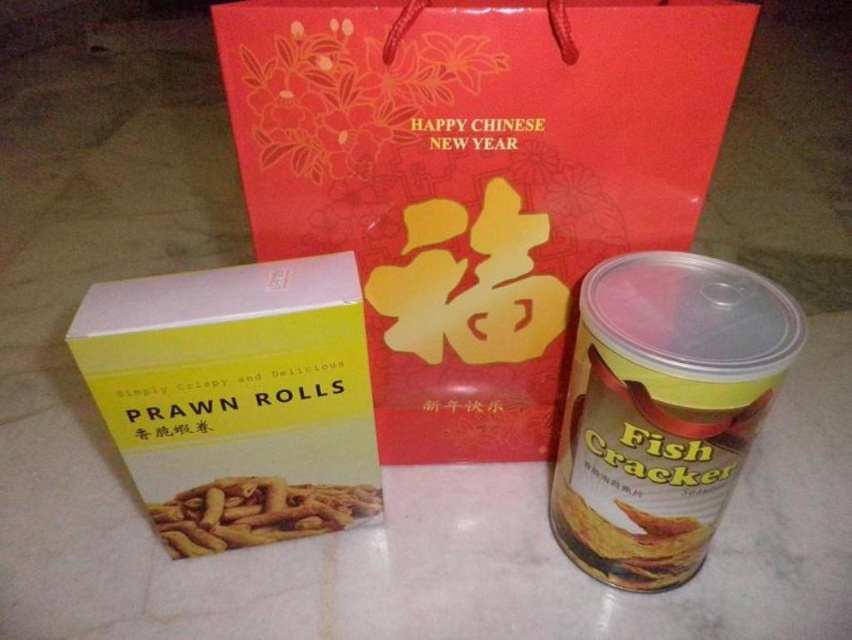
The height and width of the screenshot is (640, 852). I want to click on red paper bag at center, so click(x=475, y=179).

In the scene shown: Can you confirm if red paper bag at center is wider than yellow matte prawn rolls at center?

Indeed, red paper bag at center has a greater width compared to yellow matte prawn rolls at center.

From the picture: Who is more distant from viewer, (429, 355) or (243, 497)?

Positioned behind is point (429, 355).

Where is `red paper bag at center`? The image size is (852, 640). red paper bag at center is located at coordinates (475, 179).

Which of these two, matte plastic canister at right or yellow matte prawn rolls at center, stands shorter?

Standing shorter between the two is yellow matte prawn rolls at center.

Between point (707, 394) and point (158, 518), which one is positioned in front?

Point (707, 394)

Identify the location of matte plastic canister at right. [661, 410].

Is yellow matte prawn rolls at left thinner than yellow matte prawn rolls at center?

No.

Does point (348, 284) come in front of point (257, 484)?

Yes.

You are a GUI agent. You are given a task and a screenshot of the screen. Output one action in this format:
    pyautogui.click(x=<x>, y=<y>)
    Task: Click on the yellow matte prawn rolls at left
    Image resolution: width=852 pixels, height=640 pixels.
    Given the screenshot: What is the action you would take?
    pyautogui.click(x=235, y=397)